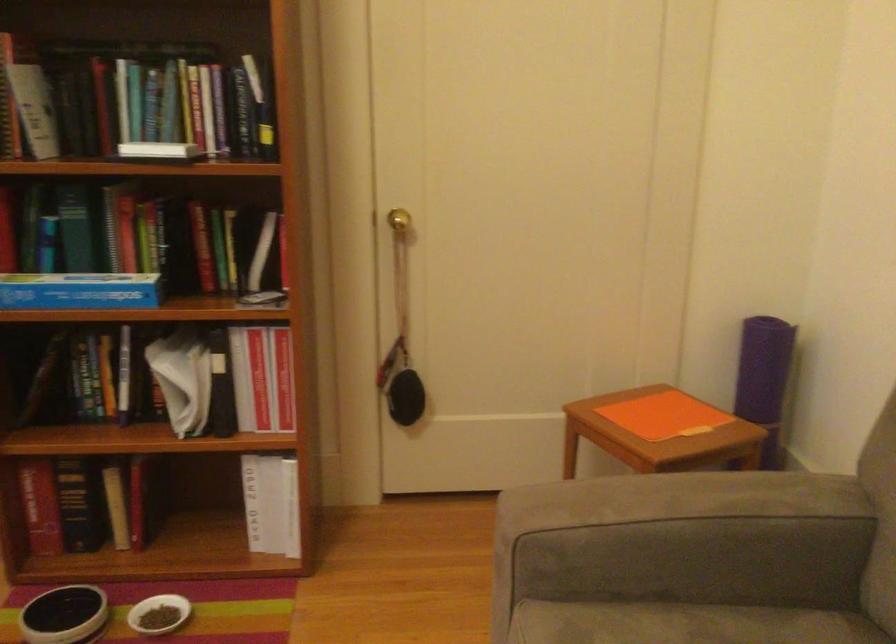
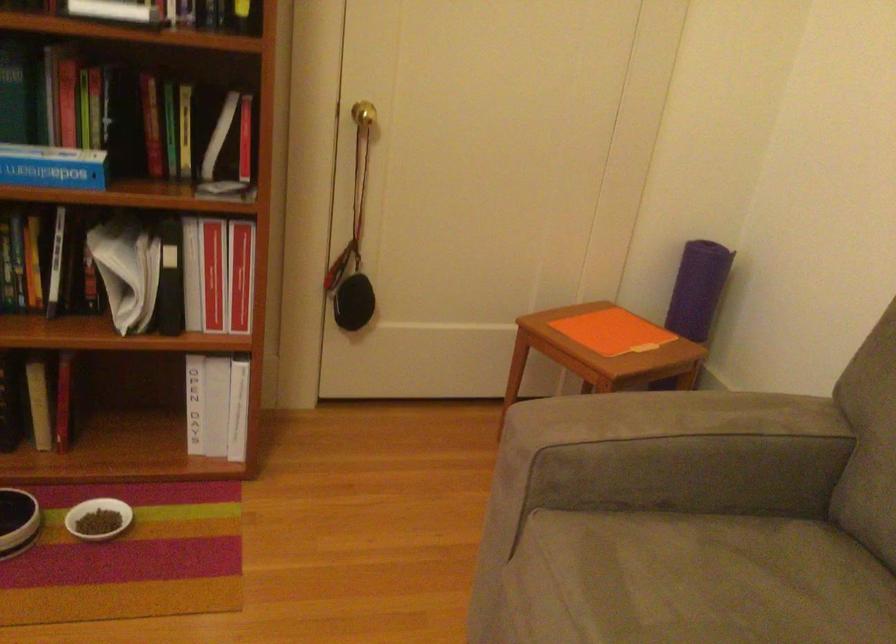
In the second image, find the point that corresponds to the point at 283,379 in the first image.

(239, 275)